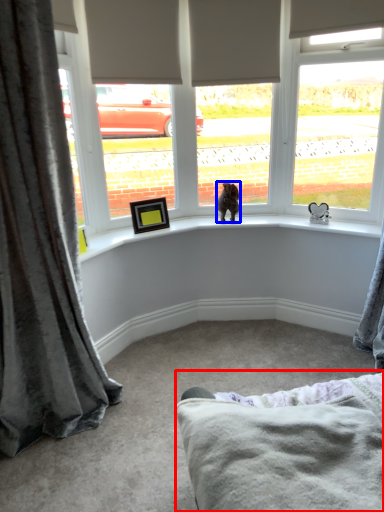
Question: Which object is closer to the camera taking this photo, bedding (highlighted by a red box) or animal (highlighted by a blue box)?

Choices:
 (A) bedding
 (B) animal

Answer: (A)